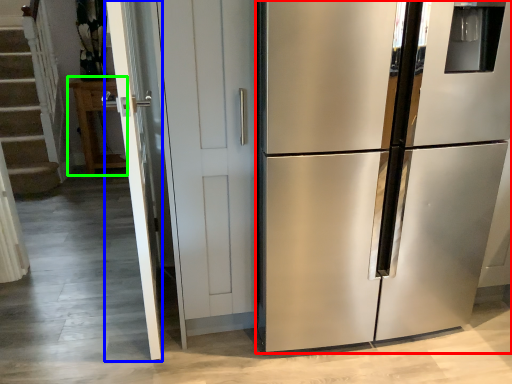
Question: Estimate the real-world distances between objects in this image. Which object is farther from refrigerator (highlighted by a red box), screen door (highlighted by a blue box) or cabinetry (highlighted by a green box)?

Choices:
 (A) screen door
 (B) cabinetry

Answer: (B)